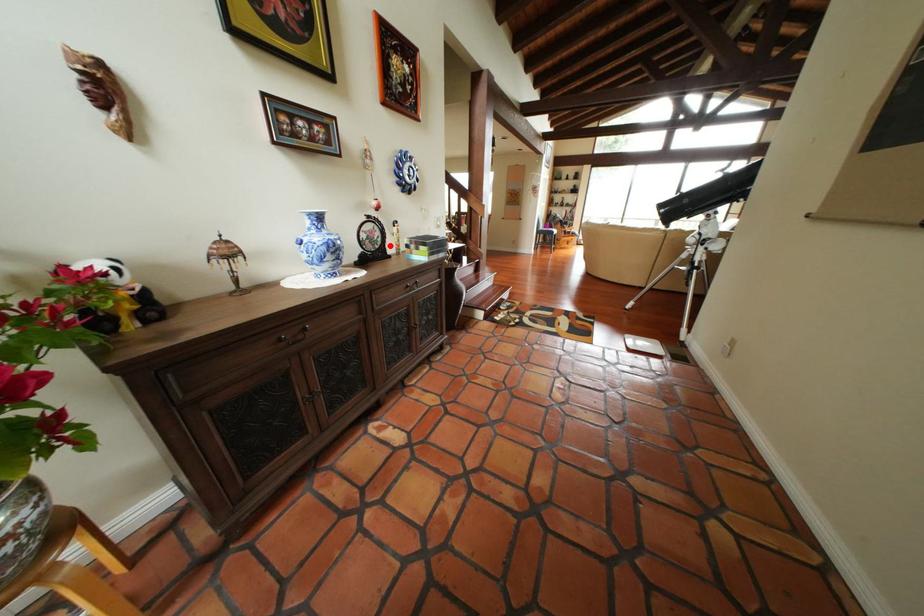
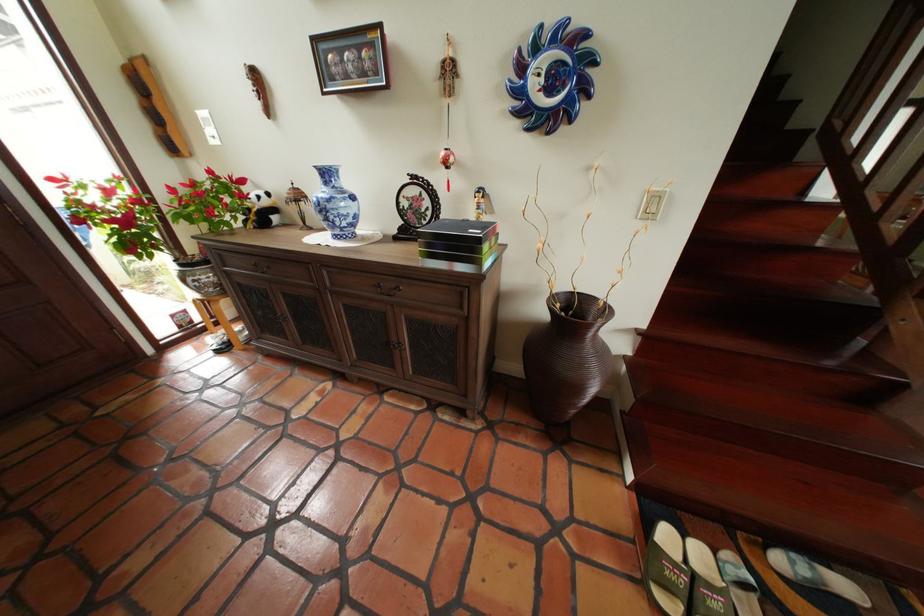
Find the pixel in the second image that matches the highlighted location in the first image.

(438, 221)